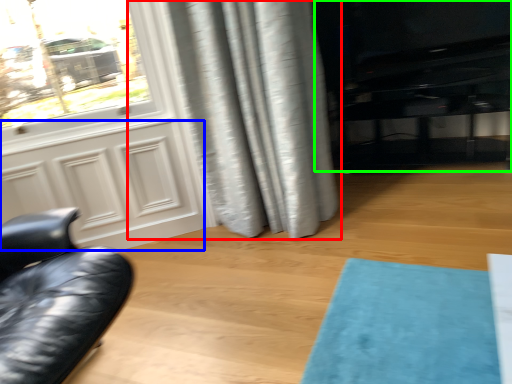
Question: Based on their relative distances, which object is farther from curtain (highlighted by a red box)? Choose from screen door (highlighted by a blue box) and entertainment center (highlighted by a green box).

Choices:
 (A) screen door
 (B) entertainment center

Answer: (B)